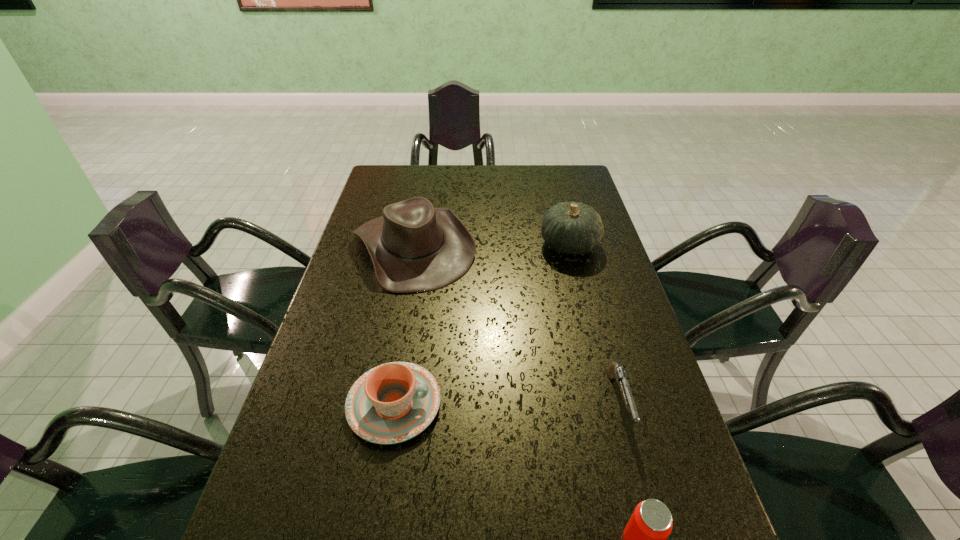
At what (x,y) coordinates should I click in order to perform the action: click on gourd that is at the right edge. Please return your answer as a coordinate pair (x, y). This screenshot has width=960, height=540. Looking at the image, I should click on (574, 228).

Locate an element on the screen. The image size is (960, 540). gun at the right edge is located at coordinates (614, 371).

Locate an element on the screen. The height and width of the screenshot is (540, 960). vacant space at the far edge of the desktop is located at coordinates (462, 185).

In the image, there is a desktop. Where is `free region at the left edge`? free region at the left edge is located at coordinates (375, 211).

The height and width of the screenshot is (540, 960). Identify the location of free space at the right edge. (601, 250).

Image resolution: width=960 pixels, height=540 pixels. In the image, there is a desktop. Find the location of `vacant space at the far left corner`. vacant space at the far left corner is located at coordinates (395, 185).

You are a GUI agent. You are given a task and a screenshot of the screen. Output one action in this format:
    pyautogui.click(x=<x>, y=<y>)
    Task: Click on the free space at the far right corner
    The width and height of the screenshot is (960, 540).
    Given the screenshot: What is the action you would take?
    click(565, 191)

The height and width of the screenshot is (540, 960). Find the location of `free space between the chinaware and the gourd`. free space between the chinaware and the gourd is located at coordinates tap(482, 325).

Locate an element on the screen. This screenshot has height=540, width=960. free space between the gourd and the cowboy hat is located at coordinates (492, 246).

At what (x,y) coordinates should I click in order to perform the action: click on free area in between the chinaware and the gun. Please return your answer as a coordinate pair (x, y). The width and height of the screenshot is (960, 540). Looking at the image, I should click on pos(507,403).